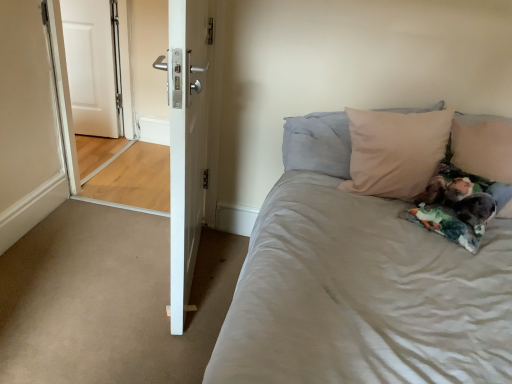
Locate an element on the screen. This screenshot has height=384, width=512. vacant space situated on the left part of white glossy door at center, the 2th door from the left is located at coordinates (97, 265).